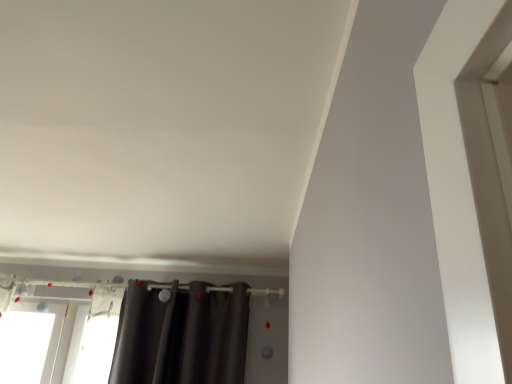
This screenshot has width=512, height=384. What do you see at coordinates (211, 282) in the screenshot?
I see `dark gray curtain at lower left` at bounding box center [211, 282].

Measure the distance between point (229,279) and camera.

They are 3.03 meters apart.

Identify the location of dark gray curtain at lower left. The width and height of the screenshot is (512, 384). (211, 282).

Where is `dark gray curtain at lower left`? dark gray curtain at lower left is located at coordinates (211, 282).